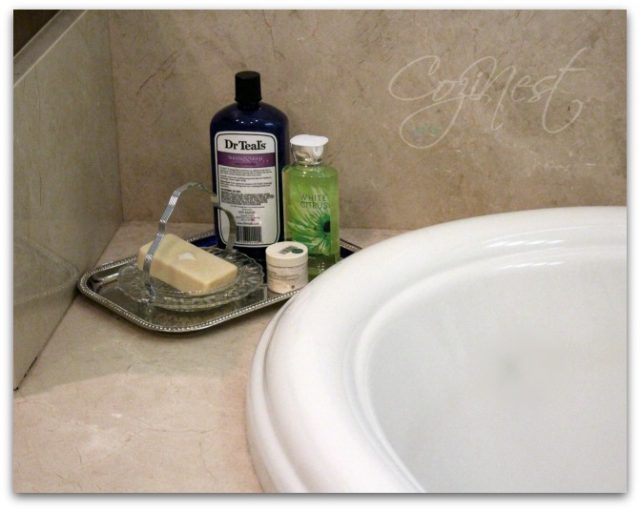
This screenshot has height=510, width=640. I want to click on soap bar, so click(x=198, y=264).